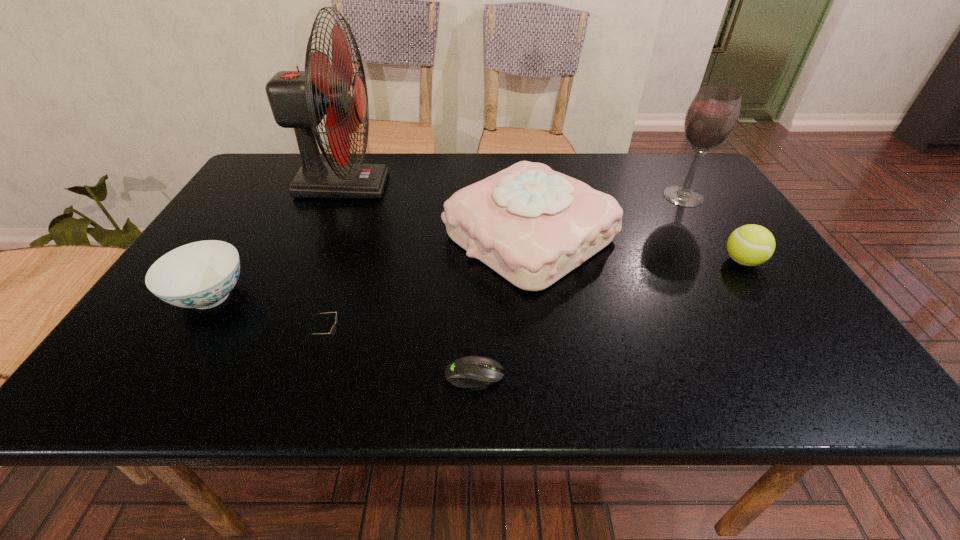
The width and height of the screenshot is (960, 540). I want to click on the tallest object, so click(x=298, y=99).

Find the location of a particular element. The width and height of the screenshot is (960, 540). the second tallest object is located at coordinates (713, 113).

Where is `cake`? The image size is (960, 540). cake is located at coordinates (532, 225).

Find the location of `tennis ball`. tennis ball is located at coordinates (750, 245).

This screenshot has height=540, width=960. Find the location of `chinaware`. chinaware is located at coordinates (201, 275).

Find the location of a particular element. the second shortest object is located at coordinates (333, 329).

Locate an element on the screen. computer mouse is located at coordinates (471, 371).

Where is `free spot located on the front-facing side of the fan`? This screenshot has height=540, width=960. free spot located on the front-facing side of the fan is located at coordinates (488, 186).

Locate an element on the screen. vacant region located on the front of the alcohol is located at coordinates (725, 264).

Where is `vacant space located 0.310m on the left of the cake`? The height and width of the screenshot is (540, 960). vacant space located 0.310m on the left of the cake is located at coordinates (320, 237).